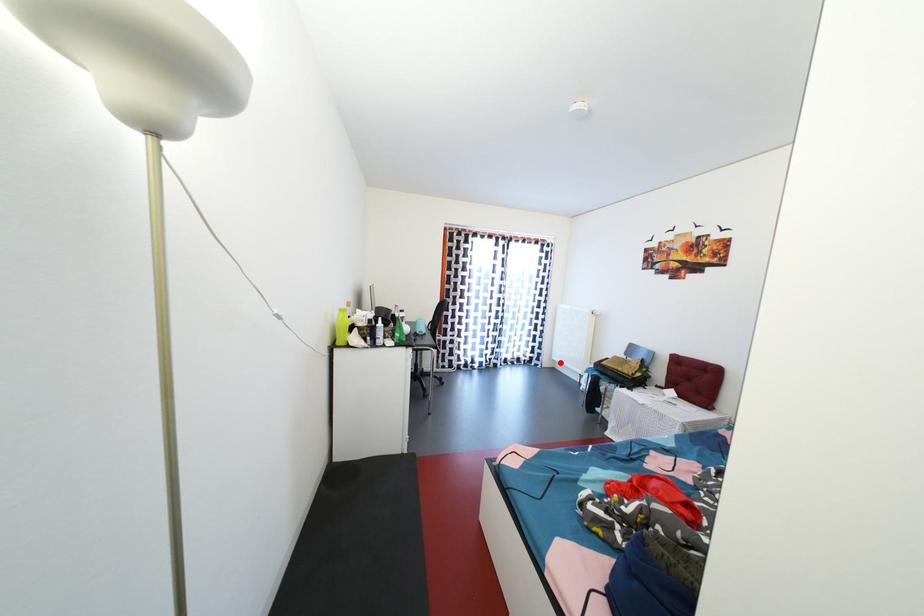
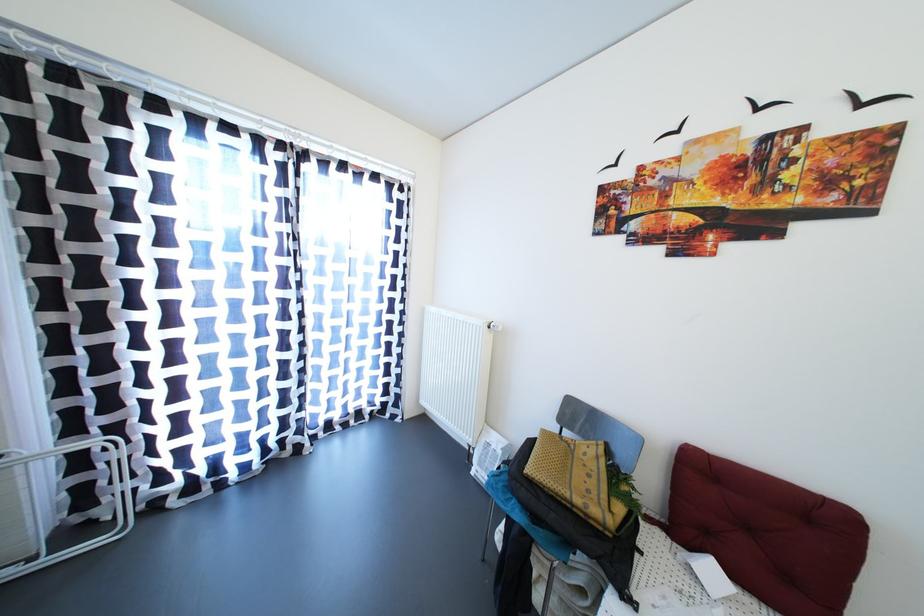
Question: I am providing you with two images of the same scene from different viewpoints. A red point is marked on the first image. Can you still see the location of the red point in image 2?

Choices:
 (A) Yes
 (B) No

Answer: (A)